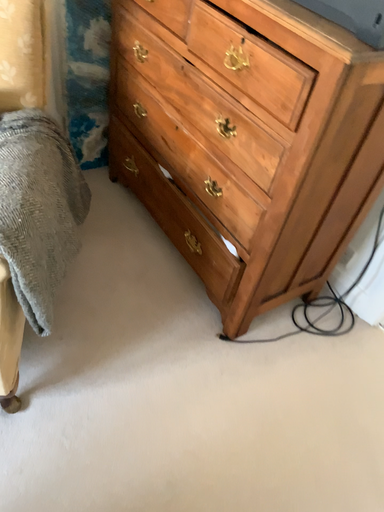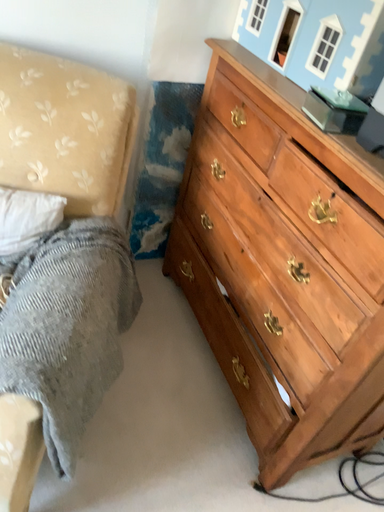
Question: How did the camera likely rotate when shooting the video?

Choices:
 (A) rotated upward
 (B) rotated downward

Answer: (A)